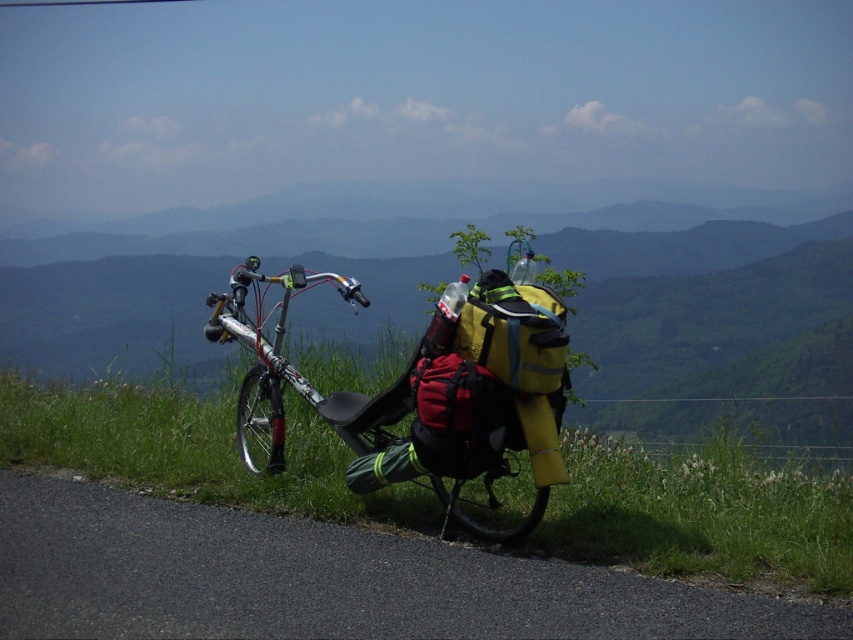
Can you confirm if black asphalt road at lower left is thinner than green grass at lower left?

No, black asphalt road at lower left is not thinner than green grass at lower left.

Who is positioned more to the right, black asphalt road at lower left or green grass at lower left?

From the viewer's perspective, green grass at lower left appears more on the right side.

This screenshot has height=640, width=853. I want to click on black asphalt road at lower left, so point(325,580).

Is green grass at lower left taller than silver metallic bicycle at center?

In fact, green grass at lower left may be shorter than silver metallic bicycle at center.

The width and height of the screenshot is (853, 640). Find the location of `green grass at lower left`. green grass at lower left is located at coordinates (700, 513).

Between point (201, 428) and point (253, 259), which one is positioned behind?

The point (201, 428) is more distant.

The height and width of the screenshot is (640, 853). What are the coordinates of `green grass at lower left` in the screenshot? It's located at [700, 513].

Can you confirm if black asphalt road at lower left is taller than silver metallic bicycle at center?

No.

Between black asphalt road at lower left and silver metallic bicycle at center, which one has less height?

Standing shorter between the two is black asphalt road at lower left.

The image size is (853, 640). Identify the location of black asphalt road at lower left. (325, 580).